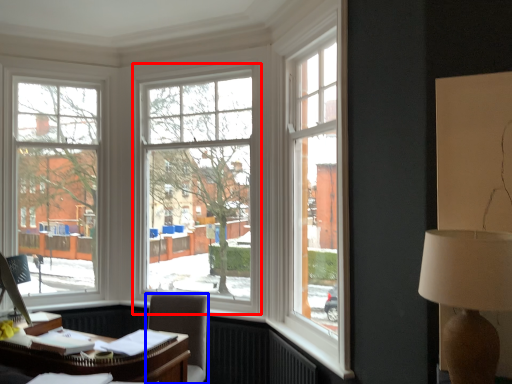
Question: Which object is further to the camera taking this photo, window (highlighted by a red box) or chair (highlighted by a blue box)?

Choices:
 (A) window
 (B) chair

Answer: (A)